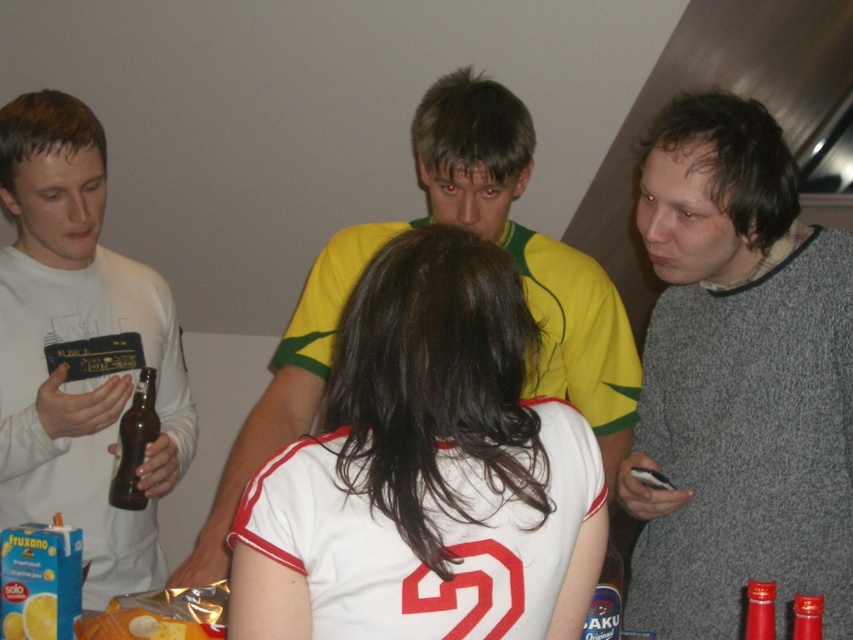
Can you confirm if brown glass bottle at center is positioned above yellow matte lemon at lower left?

Yes.

This screenshot has width=853, height=640. Identify the location of brown glass bottle at center. (134, 444).

Locate an element on the screen. The width and height of the screenshot is (853, 640). brown glass bottle at center is located at coordinates (134, 444).

Is gray wool sweater at right below translucent plastic bottle at lower right?

No.

Which is below, gray wool sweater at right or translucent plastic bottle at lower right?

translucent plastic bottle at lower right is lower down.

Which is behind, point (845, 612) or point (608, 556)?

The point (608, 556) is behind.

Locate an element on the screen. The image size is (853, 640). gray wool sweater at right is located at coordinates (738, 380).

Is translucent plastic bottle at lower right to the right of red glass bottle at lower right from the viewer's perspective?

Incorrect, translucent plastic bottle at lower right is not on the right side of red glass bottle at lower right.

The height and width of the screenshot is (640, 853). What do you see at coordinates (606, 600) in the screenshot?
I see `translucent plastic bottle at lower right` at bounding box center [606, 600].

Where is `translucent plastic bottle at lower right`? Image resolution: width=853 pixels, height=640 pixels. translucent plastic bottle at lower right is located at coordinates (606, 600).